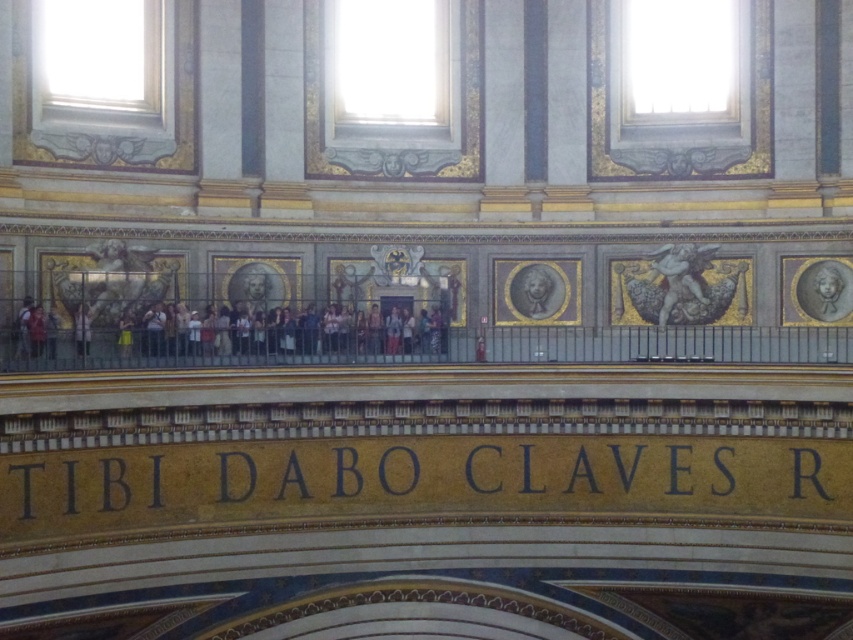
Find the location of a particular element. polished bronze cherub at upper right is located at coordinates (679, 275).

Who is higher up, polished bronze cherub at upper right or gray stone bust at center?

Positioned higher is polished bronze cherub at upper right.

Identify the location of polished bronze cherub at upper right. The width and height of the screenshot is (853, 640). (679, 275).

Locate an element on the screen. This screenshot has height=640, width=853. polished bronze cherub at upper right is located at coordinates (679, 275).

Does smooth gray stone portrait at upper right have a lesser height compared to light brown leather jacket at left?

No, smooth gray stone portrait at upper right is not shorter than light brown leather jacket at left.

Does point (834, 305) come in front of point (74, 323)?

No, it is not.

Which is behind, point (804, 308) or point (74, 323)?

Positioned behind is point (804, 308).

Locate an element on the screen. This screenshot has height=640, width=853. smooth gray stone portrait at upper right is located at coordinates (825, 289).

Between smooth gray stone portrait at upper right and gray stone bust at center, which one is positioned lower?

Positioned lower is smooth gray stone portrait at upper right.

Which is in front, point (822, 273) or point (535, 285)?

Positioned in front is point (822, 273).

Locate an element on the screen. This screenshot has height=640, width=853. smooth gray stone portrait at upper right is located at coordinates (825, 289).